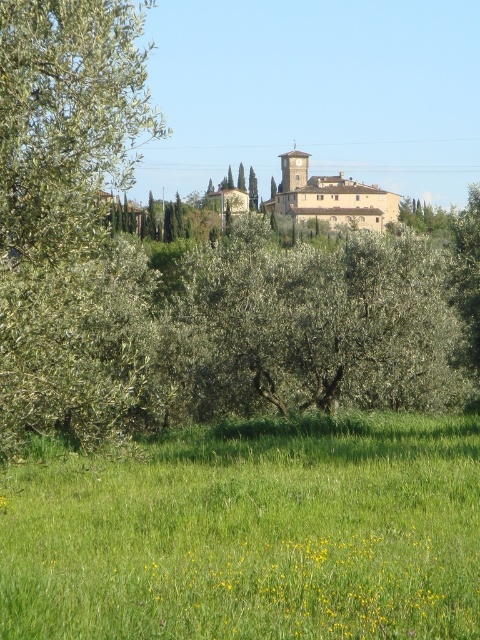
You are standing at the point with coordinates point (467, 589) and want to walk to the point with coordinates point (56, 301). Based on the scene description, will you be moving towards the background or the foreground?

You will be moving towards the background because point (467, 589) is in front of point (56, 301), meaning the destination is further away from your starting position.

You are standing in the rural landscape and want to take a photo of the green grassy field at lower center and the green leafy tree at left. Which object is positioned lower in the image?

The green grassy field at lower center is positioned below the green leafy tree at left, so it is lower in the image.

You are standing at the edge of the green grassy field at lower center and want to walk to the green leafy tree at left. Which direction should you face to start walking towards it?

You should face the left direction to start walking towards the green leafy tree at left from the green grassy field at lower center.